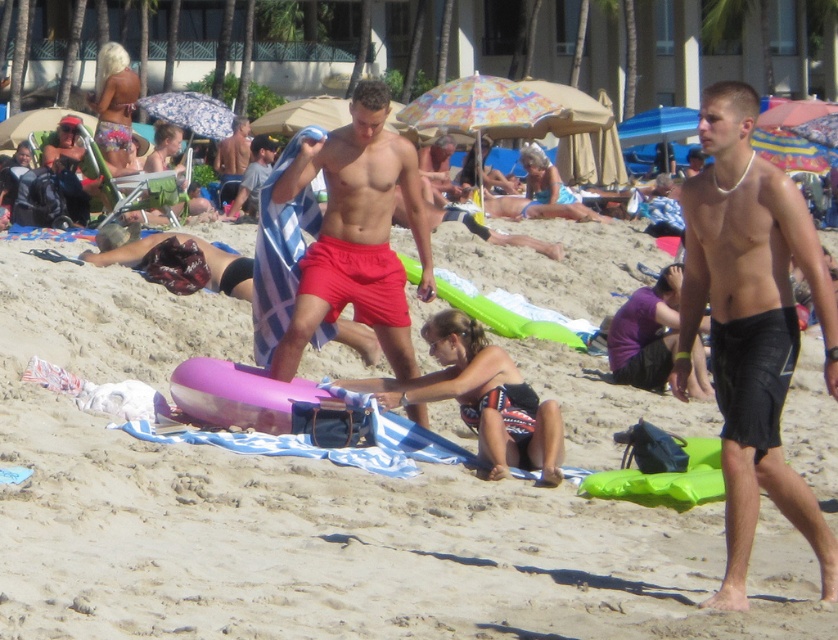
Does black matte shorts at right appear under red matte shorts at center?

Correct, black matte shorts at right is located below red matte shorts at center.

Does black matte shorts at right appear on the right side of red matte shorts at center?

Yes, black matte shorts at right is to the right of red matte shorts at center.

Between point (740, 506) and point (392, 262), which one is positioned behind?

The point (392, 262) is more distant.

Where is `black matte shorts at right`? The image size is (838, 640). black matte shorts at right is located at coordinates (751, 324).

Does point (715, 294) come farther from viewer compared to point (224, 189)?

No, it is not.

Who is more forward, (753, 449) or (226, 173)?

Positioned in front is point (753, 449).

Does point (727, 129) lie in front of point (246, 132)?

Yes, it is.

You are a GUI agent. You are given a task and a screenshot of the screen. Output one action in this format:
    pyautogui.click(x=<x>, y=<y>)
    Task: Click on the black matte shorts at right
    The image size is (838, 640).
    Given the screenshot: What is the action you would take?
    pyautogui.click(x=751, y=324)

Does red matte shorts at center appear on the right side of shiny blue towel at center?

Indeed, red matte shorts at center is positioned on the right side of shiny blue towel at center.

The image size is (838, 640). What are the coordinates of `red matte shorts at center` in the screenshot? It's located at (x=357, y=234).

What are the coordinates of `red matte shorts at center` in the screenshot? It's located at (357, 234).